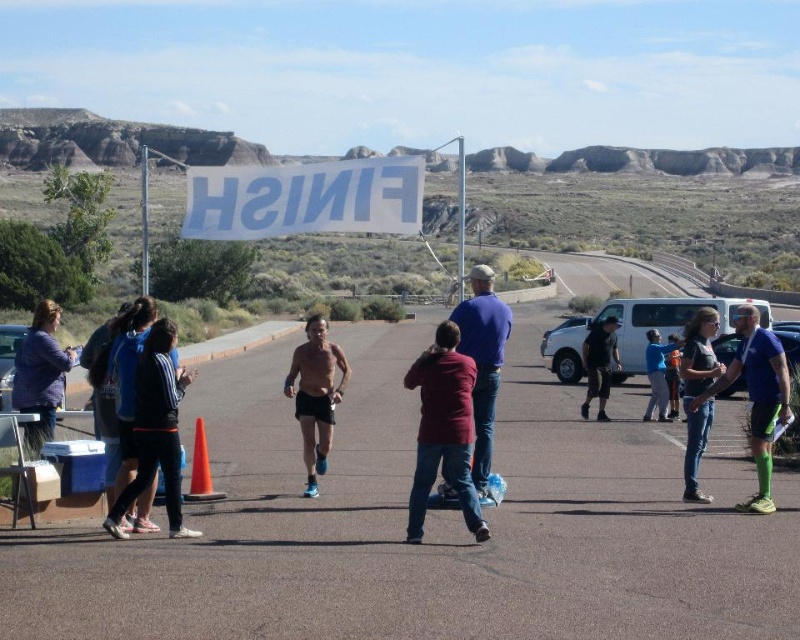
Question: Which of these objects is positioned closest to the blue fabric shirt at center?

Choices:
 (A) black matte jacket at center
 (B) maroon shirt at center
 (C) denim jeans at center

Answer: (C)

Question: Which of the following is the closest to the observer?

Choices:
 (A) (690, 300)
 (B) (758, 484)

Answer: (B)

Question: Can you confirm if maroon shirt at center is positioned to the right of dark blue sweater at center?

Choices:
 (A) no
 (B) yes

Answer: (B)

Question: Which point is closer to the camera?

Choices:
 (A) (454, 376)
 (B) (676, 397)
 (C) (116, 516)
 (D) (704, 401)

Answer: (C)

Question: Is matte purple jacket at left to the right of blue fabric jacket at center from the viewer's perspective?

Choices:
 (A) yes
 (B) no

Answer: (B)

Question: Is shiny blue shorts at center thinner than dark blue sweater at center?

Choices:
 (A) no
 (B) yes

Answer: (A)